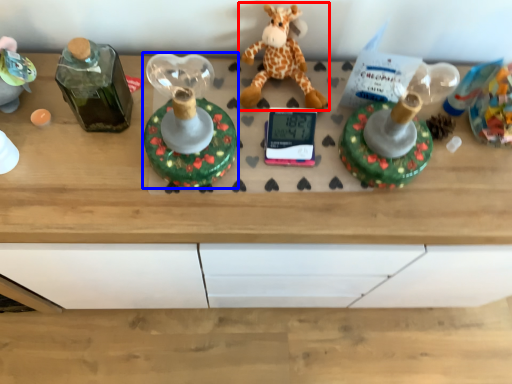
Question: Which of the following is the farthest to the observer, giraffe (highlighted by a red box) or toy (highlighted by a blue box)?

Choices:
 (A) giraffe
 (B) toy

Answer: (A)